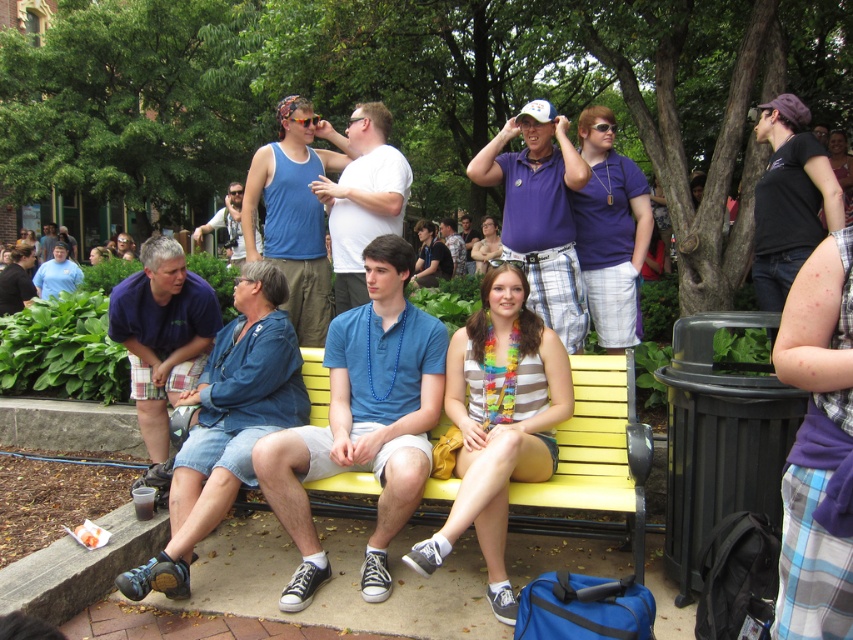
Who is taller, blue cotton tank top at upper center or matte blue tank top at center?

matte blue tank top at center is taller.

The image size is (853, 640). Find the location of `blue cotton tank top at upper center`. blue cotton tank top at upper center is located at coordinates (294, 212).

What are the coordinates of `blue cotton tank top at upper center` in the screenshot? It's located at (294, 212).

Does blue cotton shirt at center lie in front of blue cotton tank top at upper center?

Yes, blue cotton shirt at center is closer to the viewer.

Does blue cotton shirt at center appear under blue cotton tank top at upper center?

Yes.

Between point (397, 314) and point (299, 320), which one is positioned behind?

Point (299, 320)

Locate an element on the screen. Image resolution: width=853 pixels, height=640 pixels. blue cotton shirt at center is located at coordinates (363, 420).

Consider the image. Is blue cotton shirt at center above matte blue tank top at center?

No, blue cotton shirt at center is not above matte blue tank top at center.

In the scene shown: Measure the distance between blue cotton shirt at center and camera.

The distance of blue cotton shirt at center from camera is 9.98 feet.

Where is `blue cotton shirt at center`? Image resolution: width=853 pixels, height=640 pixels. blue cotton shirt at center is located at coordinates (363, 420).